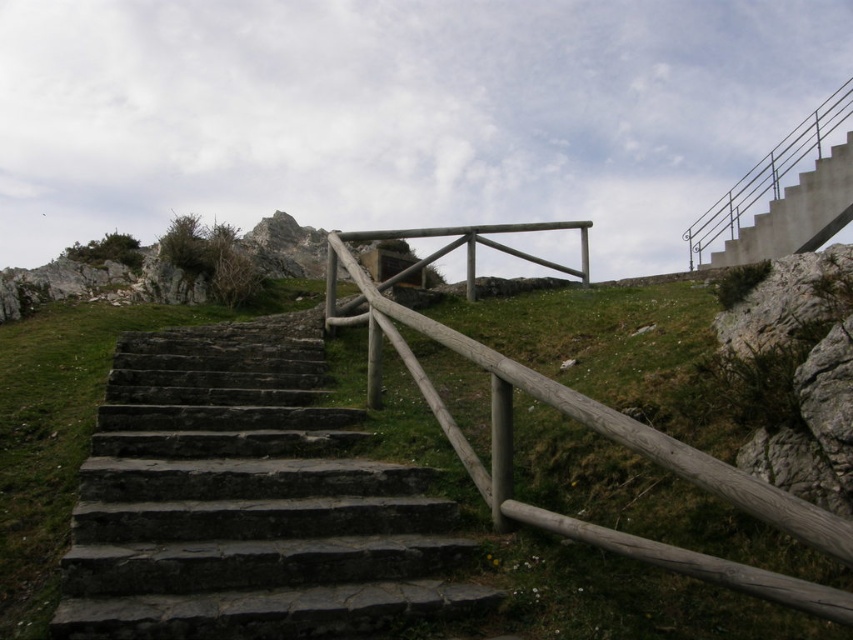
Question: Which object appears closest to the camera in this image?

Choices:
 (A) concrete/stone stairs at upper right
 (B) dark gray stone stairs at center

Answer: (B)

Question: Does wooden rail at center have a larger size compared to concrete/stone stairs at upper right?

Choices:
 (A) yes
 (B) no

Answer: (A)

Question: Where is dark gray stone stairs at center located in relation to concrete/stone stairs at upper right in the image?

Choices:
 (A) below
 (B) above

Answer: (A)

Question: Considering the real-world distances, which object is closest to the wooden rail at center?

Choices:
 (A) concrete/stone stairs at upper right
 (B) dark gray stone stairs at center

Answer: (B)

Question: Is wooden rail at center further to camera compared to concrete/stone stairs at upper right?

Choices:
 (A) no
 (B) yes

Answer: (A)

Question: Which point appears closest to the camera in this image?

Choices:
 (A) (467, 598)
 (B) (799, 189)

Answer: (A)